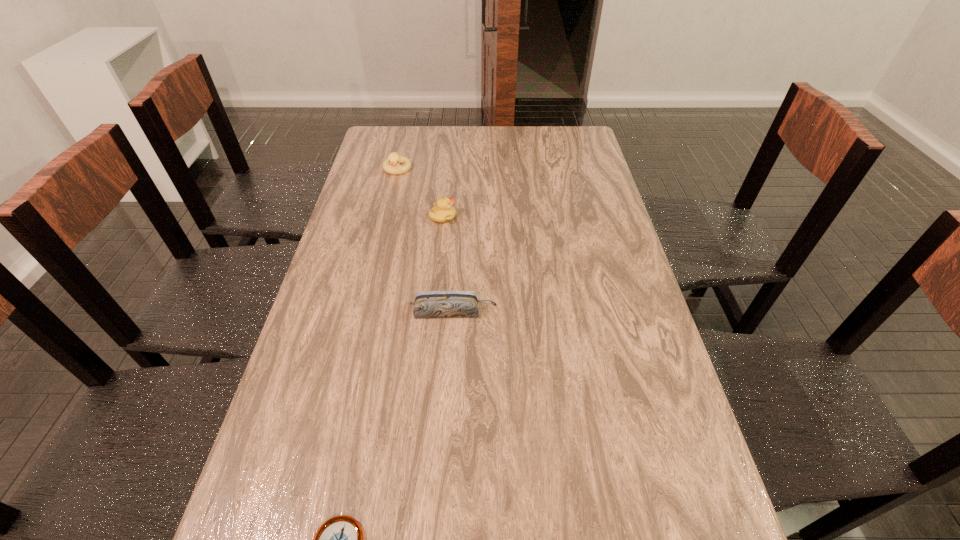
The height and width of the screenshot is (540, 960). I want to click on the farther duckling, so click(x=391, y=165).

Locate an element on the screen. The image size is (960, 540). the farthest object is located at coordinates pyautogui.click(x=391, y=165).

The height and width of the screenshot is (540, 960). I want to click on the right duckling, so click(443, 211).

Identify the location of the third nearest object. The image size is (960, 540). (443, 211).

This screenshot has width=960, height=540. Find the location of `pencil box`. pencil box is located at coordinates (453, 303).

Identify the location of vacant space positioned at the beak of the left duckling. coord(379,245).

Locate an element on the screen. The height and width of the screenshot is (540, 960). free space located on the beak of the nearer duckling is located at coordinates (526, 217).

Identify the location of blank area located on the right of the pencil box. (548, 312).

The height and width of the screenshot is (540, 960). Identify the location of object situated at the left edge. (391, 165).

In the image, there is a desktop. At what (x,y) coordinates should I click in order to perform the action: click on blank space at the far edge. Please return your answer as a coordinate pair (x, y). The image size is (960, 540). Looking at the image, I should click on click(x=536, y=150).